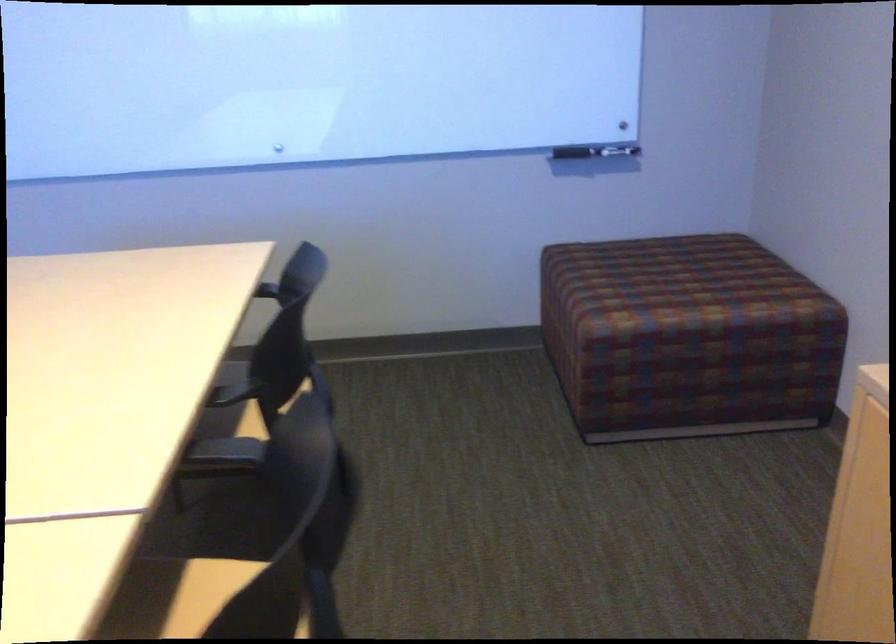
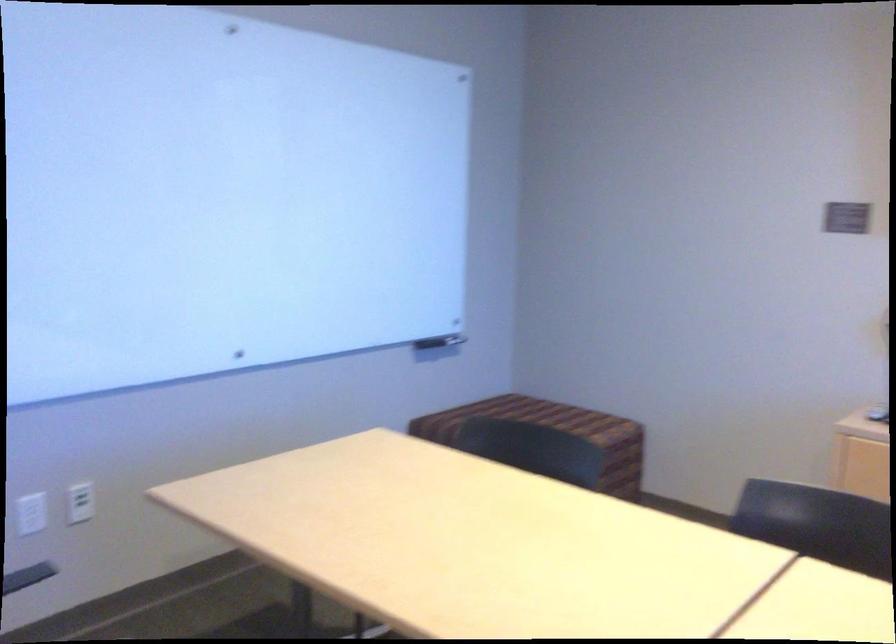
The point at [725,377] is marked in the first image. Where is the corresponding point in the second image?

(607, 482)